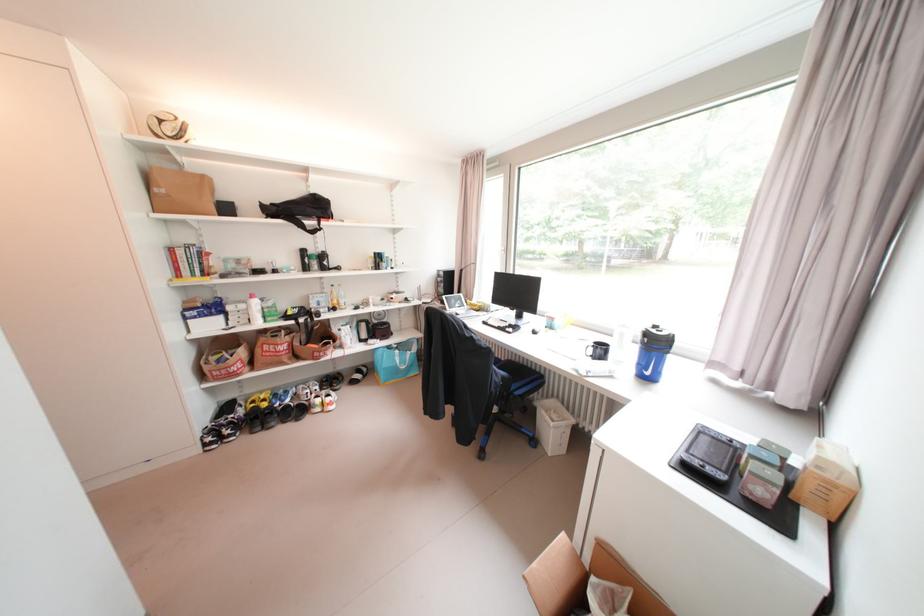
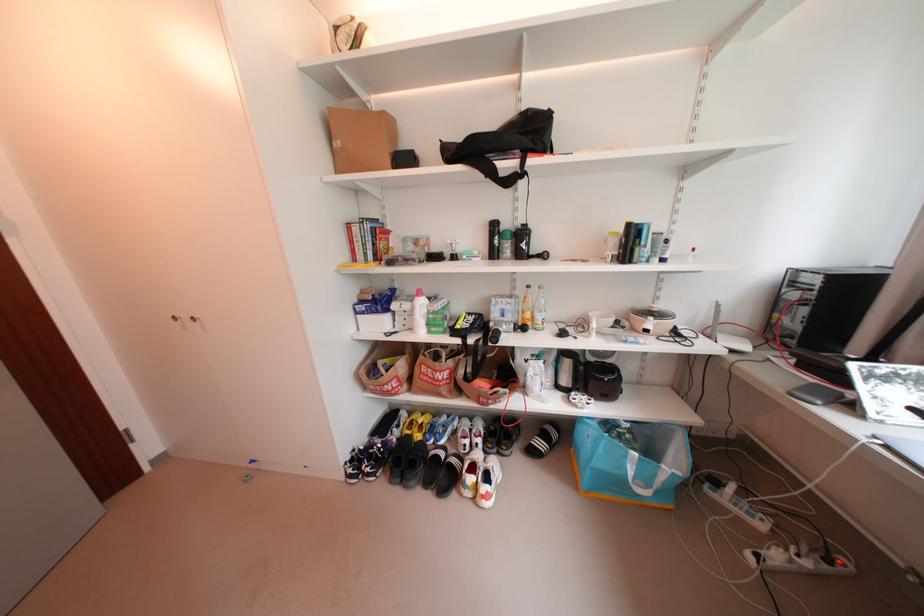
Locate, in the second image, the point that corresponds to (320,220) in the first image.

(518, 158)